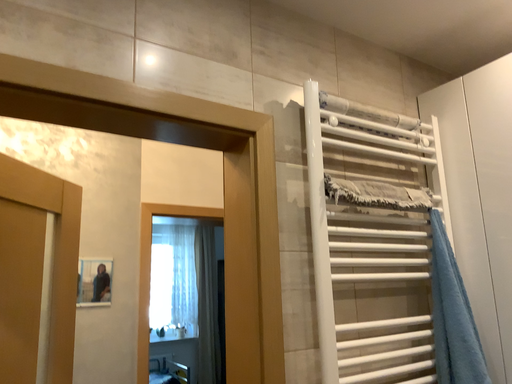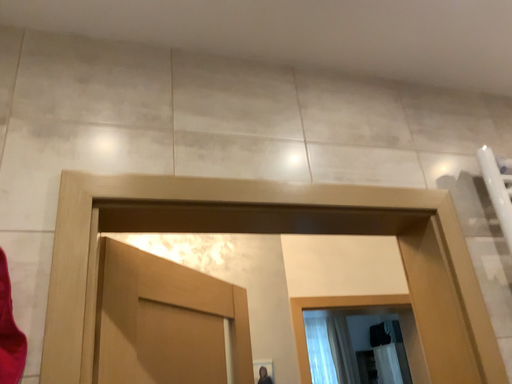
Question: How did the camera likely rotate when shooting the video?

Choices:
 (A) rotated downward
 (B) rotated upward

Answer: (B)